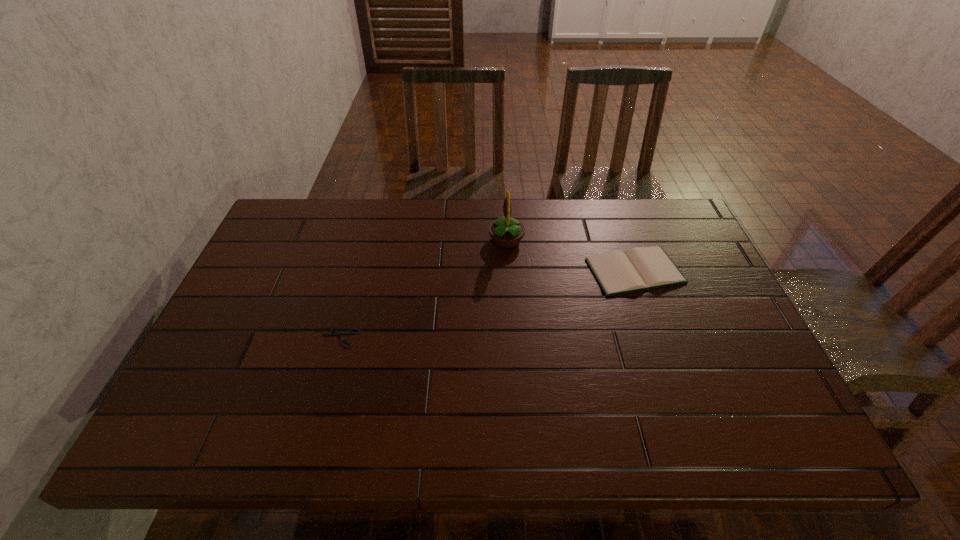
This screenshot has width=960, height=540. I want to click on free space that satisfies the following two spatial constraints: 1. on the face of the second object from left to right; 2. on the left side of the second tallest object, so click(x=508, y=271).

This screenshot has width=960, height=540. Find the location of `free spot that satisfies the following two spatial constraints: 1. on the face of the second object from right to left; 2. on the right side of the hardback book`. free spot that satisfies the following two spatial constraints: 1. on the face of the second object from right to left; 2. on the right side of the hardback book is located at coordinates (508, 271).

Where is `vacant space that satisfies the following two spatial constraints: 1. on the face of the second object from right to left; 2. on the front side of the leftmost object`? The width and height of the screenshot is (960, 540). vacant space that satisfies the following two spatial constraints: 1. on the face of the second object from right to left; 2. on the front side of the leftmost object is located at coordinates (513, 338).

The height and width of the screenshot is (540, 960). What are the coordinates of `vacant space that satisfies the following two spatial constraints: 1. on the face of the second object from left to right; 2. on the left side of the rightmost object` in the screenshot? It's located at (508, 271).

This screenshot has width=960, height=540. Identify the location of vacant region that satisfies the following two spatial constraints: 1. on the face of the tallest object; 2. on the left side of the rightmost object. (508, 271).

Find the location of a particular element. vacant area in the image that satisfies the following two spatial constraints: 1. on the face of the sunflower; 2. on the back side of the rightmost object is located at coordinates (508, 271).

I want to click on free space that satisfies the following two spatial constraints: 1. on the face of the second object from left to right; 2. on the right side of the second shortest object, so 508,271.